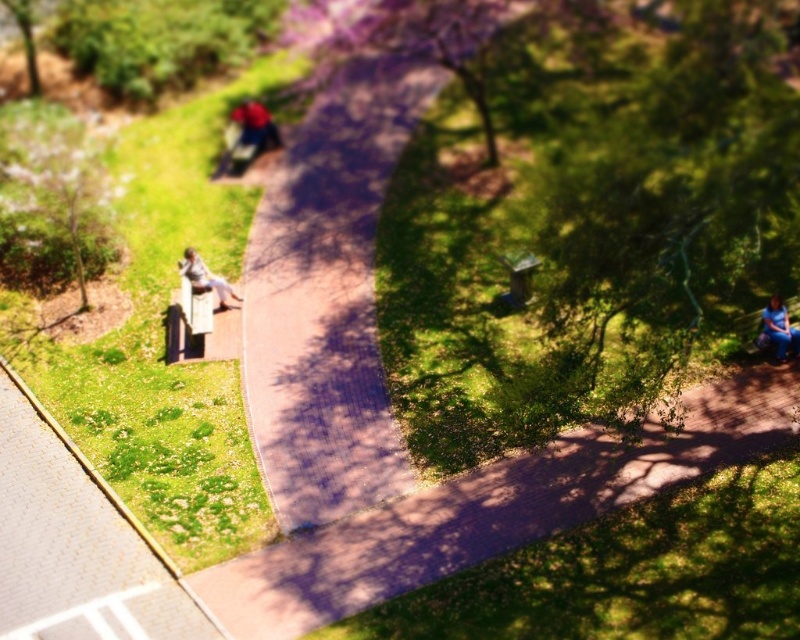
Question: Which point is farther to the camera?

Choices:
 (A) matte silver statue at center-left
 (B) purple brick path at center

Answer: (A)

Question: Which point appears closest to the camera in this image?

Choices:
 (A) (328, 83)
 (B) (72, 518)
 (C) (592, 500)
 (D) (772, 298)

Answer: (B)

Question: Which is nearer to the green grass at lower left?

Choices:
 (A) blue fabric person at lower right
 (B) wooden park bench at lower left

Answer: (B)

Question: Does purple brick path at center have a smaller size compared to paved brick path at center?

Choices:
 (A) no
 (B) yes

Answer: (A)

Question: Is purple brick path at center bigger than blue fabric person at lower right?

Choices:
 (A) no
 (B) yes

Answer: (B)

Question: Where is wooden park bench at lower left located in relation to matte silver statue at center-left in the image?

Choices:
 (A) below
 (B) above

Answer: (A)